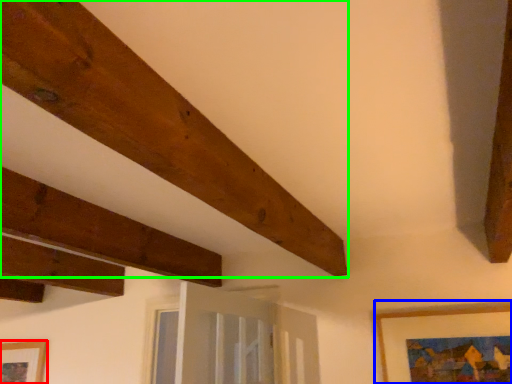
Question: Based on their relative distances, which object is farther from picture frame (highlighted by a red box)? Choose from picture frame (highlighted by a blue box) and plank (highlighted by a green box).

Choices:
 (A) picture frame
 (B) plank

Answer: (A)